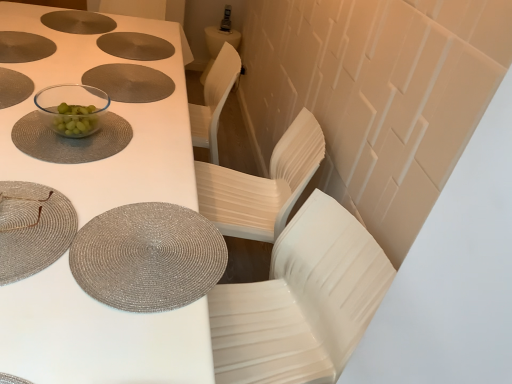
This screenshot has height=384, width=512. In order to click on vacant region below silver textured placemat at lower left, which ranks as the 1th tableware in bottom-to-top order (from a real-world perspective) in this screenshot , I will do `click(135, 246)`.